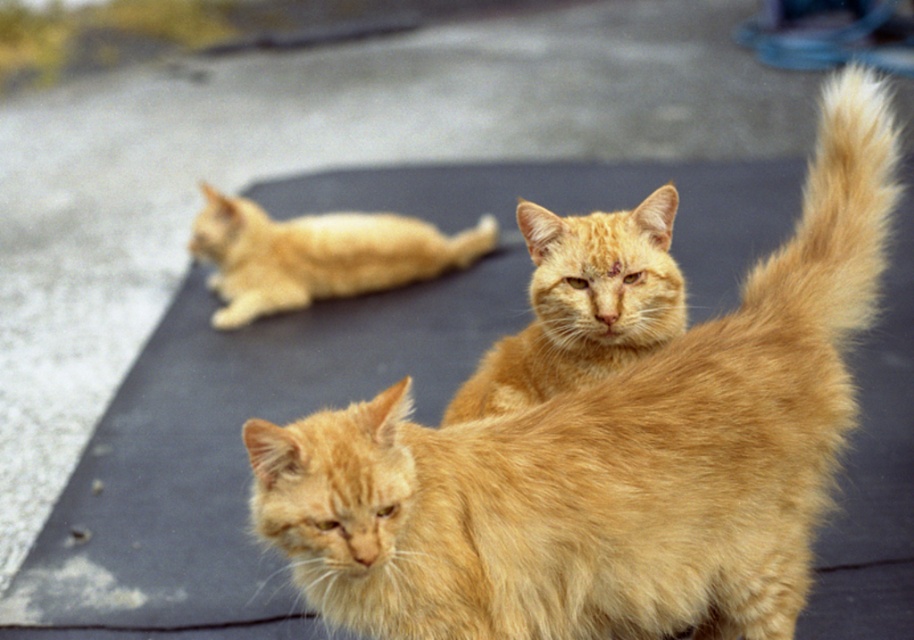
You are trying to fit both the fluffy orange cat at center and the blonde fur cat at upper left into a rectangular pet carrier. Which cat requires a wider space due to its size?

The fluffy orange cat at center requires a wider space because it might be wider than the blonde fur cat at upper left.

You are a photographer trying to capture a photo of the fluffy golden tail at upper right and the blonde fur cat at upper left. Which object is located to the right of the other?

The fluffy golden tail at upper right is positioned on the right side of blonde fur cat at upper left.

You are a photographer trying to capture a photo of the fluffy orange cat at center and the orange fur cat at center. Which cat is positioned lower in the image?

The fluffy orange cat at center is located below the orange fur cat at center, so it is positioned lower in the image.